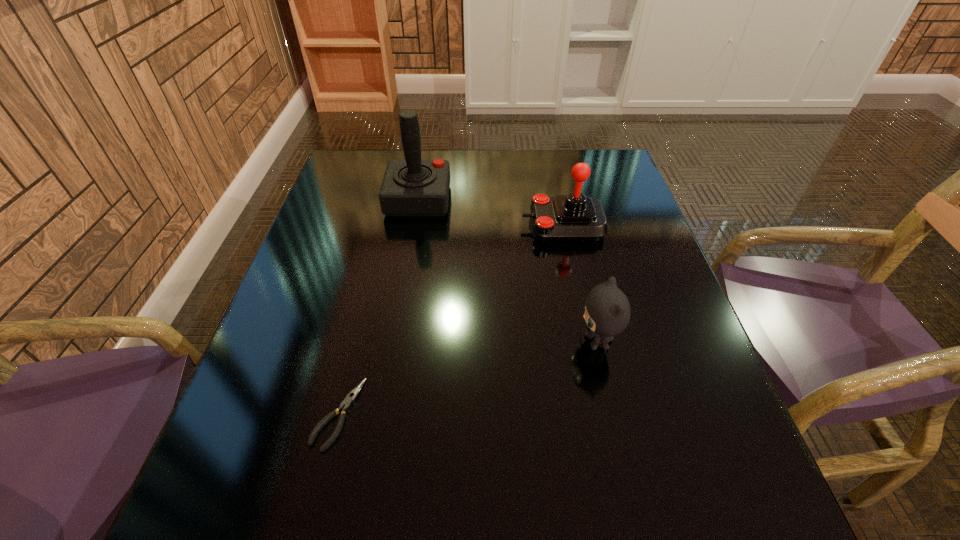
At what (x,y) coordinates should I click in order to perform the action: click on vacant space located 0.130m on the base of the third shortest object. Please return your answer as a coordinate pair (x, y). Looking at the image, I should click on tap(471, 225).

Locate an element on the screen. This screenshot has height=540, width=960. vacant point located 0.280m on the base of the third shortest object is located at coordinates (x=413, y=225).

Identify the location of free space located on the front-facing side of the kitten. The width and height of the screenshot is (960, 540). (x=552, y=342).

Locate an element on the screen. vacant space located 0.380m on the front-facing side of the kitten is located at coordinates (386, 342).

The height and width of the screenshot is (540, 960). Find the location of `free location located on the front-facing side of the kitten`. free location located on the front-facing side of the kitten is located at coordinates (481, 342).

The height and width of the screenshot is (540, 960). Identify the location of vacant space situated 0.150m on the left of the nearest object. (230, 414).

Locate an element on the screen. This screenshot has height=540, width=960. object located at the far edge is located at coordinates (412, 187).

Where is `object that is at the left edge`? The image size is (960, 540). object that is at the left edge is located at coordinates (345, 405).

The height and width of the screenshot is (540, 960). Identify the location of joystick that is at the right edge. (575, 217).

Identify the location of kitten that is at the right edge. (607, 313).